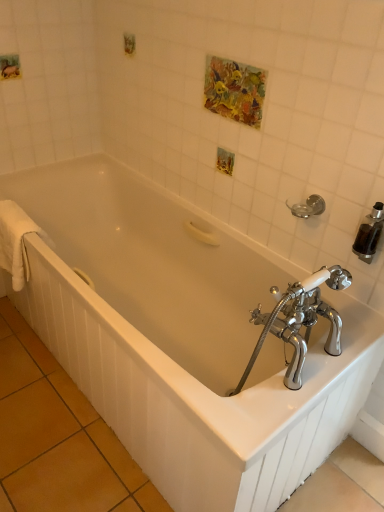
Measure the distance between point (312, 202) and camera.

A distance of 1.40 meters exists between point (312, 202) and camera.

Locate an element on the screen. The height and width of the screenshot is (512, 384). white glossy bathtub at center is located at coordinates (183, 338).

What are the coordinates of `silver metallic towel bar at upper right` in the screenshot? It's located at (308, 207).

Is white glossy bathtub at center located within white soft towel at left?

That's incorrect, white glossy bathtub at center is not inside white soft towel at left.

Between white soft towel at left and white glossy bathtub at center, which one is positioned in front?

Positioned in front is white glossy bathtub at center.

Is white soft towel at left not close to white glossy bathtub at center?

No, there isn't a large distance between white soft towel at left and white glossy bathtub at center.

Considering the sizes of white soft towel at left and white glossy bathtub at center in the image, is white soft towel at left bigger or smaller than white glossy bathtub at center?

Considering their sizes, white soft towel at left takes up less space than white glossy bathtub at center.

Which object is more forward, white glossy bathtub at center or silver metallic towel bar at upper right?

white glossy bathtub at center is closer to the camera.

Is silver metallic towel bar at upper right a part of white glossy bathtub at center?

No, silver metallic towel bar at upper right is not inside white glossy bathtub at center.

Considering the relative sizes of white glossy bathtub at center and silver metallic towel bar at upper right in the image provided, is white glossy bathtub at center thinner than silver metallic towel bar at upper right?

No, white glossy bathtub at center is not thinner than silver metallic towel bar at upper right.

Can you confirm if white glossy bathtub at center is positioned to the left of silver metallic towel bar at upper right?

Yes.

Is silver metallic towel bar at upper right positioned behind white glossy bathtub at center?

Yes, it is.

Considering the relative sizes of silver metallic towel bar at upper right and white glossy bathtub at center in the image provided, is silver metallic towel bar at upper right wider than white glossy bathtub at center?

No, silver metallic towel bar at upper right is not wider than white glossy bathtub at center.

Can you confirm if silver metallic towel bar at upper right is shorter than white glossy bathtub at center?

Yes.

From a real-world perspective, which is physically above, silver metallic towel bar at upper right or white glossy bathtub at center?

silver metallic towel bar at upper right.

Is white soft towel at left situated inside silver metallic towel bar at upper right or outside?

white soft towel at left is spatially situated outside silver metallic towel bar at upper right.

Considering the sizes of objects white soft towel at left and silver metallic towel bar at upper right in the image provided, who is thinner, white soft towel at left or silver metallic towel bar at upper right?

Thinner between the two is silver metallic towel bar at upper right.

From the image's perspective, which object appears higher, white soft towel at left or silver metallic towel bar at upper right?

silver metallic towel bar at upper right appears higher in the image.

Considering the relative sizes of silver metallic towel bar at upper right and white soft towel at left in the image provided, is silver metallic towel bar at upper right wider than white soft towel at left?

No.

Considering the positions of objects silver metallic towel bar at upper right and white soft towel at left in the image provided, who is more to the right, silver metallic towel bar at upper right or white soft towel at left?

From the viewer's perspective, silver metallic towel bar at upper right appears more on the right side.

Could you tell me if silver metallic towel bar at upper right is facing white soft towel at left?

No, silver metallic towel bar at upper right is not turned towards white soft towel at left.

This screenshot has width=384, height=512. Identify the location of towel bar on the right of white soft towel at left. (308, 207).

Which is nearer, (159, 352) or (0, 238)?

Point (159, 352)

Could you tell me if white glossy bathtub at center is facing white soft towel at left?

Yes, white glossy bathtub at center faces towards white soft towel at left.

From their relative heights in the image, would you say white glossy bathtub at center is taller or shorter than white soft towel at left?

In the image, white glossy bathtub at center appears to be taller than white soft towel at left.

In the image, there is a white glossy bathtub at center. What are the coordinates of `bath towel above it (from the image's perspective)` in the screenshot? It's located at (15, 242).

The height and width of the screenshot is (512, 384). Find the location of `bathtub that appears on the left of silver metallic towel bar at upper right`. bathtub that appears on the left of silver metallic towel bar at upper right is located at coordinates (183, 338).

From the image, which object appears to be farther from white soft towel at left, silver metallic towel bar at upper right or white glossy bathtub at center?

silver metallic towel bar at upper right is further to white soft towel at left.

When comparing their distances from silver metallic towel bar at upper right, does white glossy bathtub at center or white soft towel at left seem further?

white soft towel at left is further to silver metallic towel bar at upper right.

Estimate the real-world distances between objects in this image. Which object is closer to white glossy bathtub at center, silver metallic towel bar at upper right or white soft towel at left?

white soft towel at left is positioned closer to the anchor white glossy bathtub at center.

Based on their spatial positions, is white soft towel at left or silver metallic towel bar at upper right closer to white glossy bathtub at center?

white soft towel at left.

When comparing their distances from silver metallic towel bar at upper right, does white soft towel at left or white glossy bathtub at center seem closer?

white glossy bathtub at center is positioned closer to the anchor silver metallic towel bar at upper right.

Based on their spatial positions, is white glossy bathtub at center or silver metallic towel bar at upper right further from white soft towel at left?

The object further to white soft towel at left is silver metallic towel bar at upper right.

You are a GUI agent. You are given a task and a screenshot of the screen. Output one action in this format:
    pyautogui.click(x=<x>, y=<y>)
    Task: Click on the bathtub situated between white soft towel at left and silver metallic towel bar at upper right from left to right
    
    Given the screenshot: What is the action you would take?
    pyautogui.click(x=183, y=338)